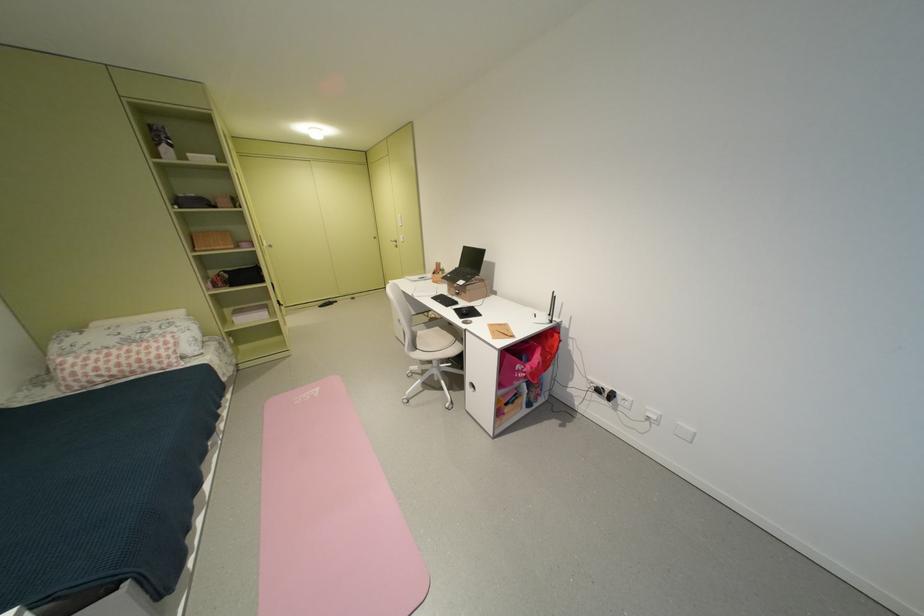
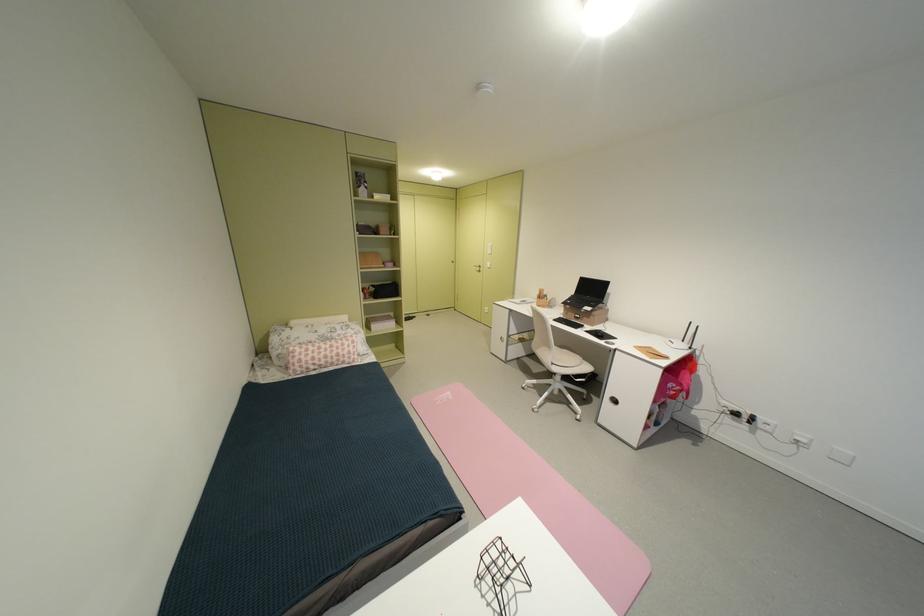
Question: Which direction would the cameraman need to move to produce the second image? Reply with the corresponding letter.

Choices:
 (A) Left
 (B) Right
 (C) Forward
 (D) Backward

Answer: (A)